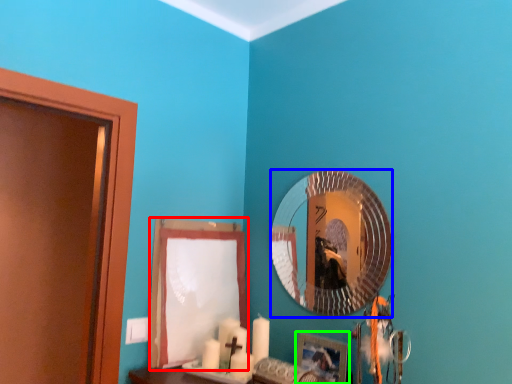
Question: Considering the real-world distances, which object is farthest from curtain (highlighted by a red box)? mirror (highlighted by a blue box) or picture frame (highlighted by a green box)?

Choices:
 (A) mirror
 (B) picture frame

Answer: (B)